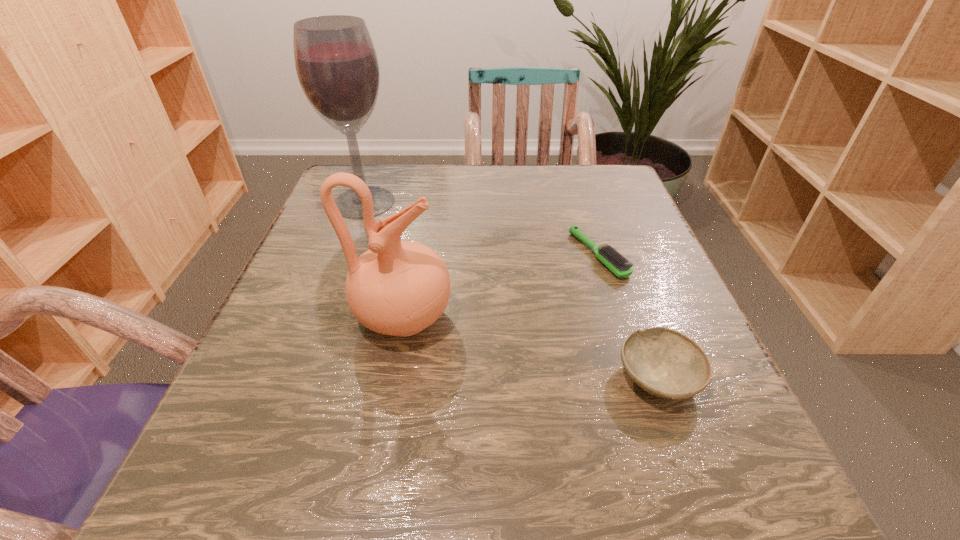
Identify the location of blank space that satisfies the following two spatial constraints: 1. on the spout of the second shortest object; 2. on the right side of the pottery. This screenshot has height=540, width=960. (393, 378).

At what (x,y) coordinates should I click in order to perform the action: click on free location that satisfies the following two spatial constraints: 1. on the spout of the third shortest object; 2. on the right side of the third tallest object. Please return your answer as a coordinate pair (x, y). The height and width of the screenshot is (540, 960). Looking at the image, I should click on (393, 378).

At what (x,y) coordinates should I click in order to perform the action: click on free location that satisfies the following two spatial constraints: 1. on the front side of the hairbrush; 2. on the spout of the second tallest object. Please return your answer as a coordinate pair (x, y). The height and width of the screenshot is (540, 960). Looking at the image, I should click on (619, 317).

Where is `vacant space that satisfies the following two spatial constraints: 1. on the front side of the second shortest object; 2. on the right side of the third nearest object`? The height and width of the screenshot is (540, 960). vacant space that satisfies the following two spatial constraints: 1. on the front side of the second shortest object; 2. on the right side of the third nearest object is located at coordinates (639, 378).

Identify the location of free location that satisfies the following two spatial constraints: 1. on the front side of the third nearest object; 2. on the spout of the third shortest object. (619, 317).

At what (x,y) coordinates should I click in order to perform the action: click on free space that satisfies the following two spatial constraints: 1. on the spout of the third shortest object; 2. on the right side of the bowl. Please return your answer as a coordinate pair (x, y). Looking at the image, I should click on (393, 378).

This screenshot has width=960, height=540. In order to click on free location that satisfies the following two spatial constraints: 1. on the spout of the third tallest object; 2. on the right side of the pottery in this screenshot , I will do `click(393, 378)`.

What are the coordinates of `free location that satisfies the following two spatial constraints: 1. on the spout of the second tallest object; 2. on the right side of the bowl` in the screenshot? It's located at (393, 378).